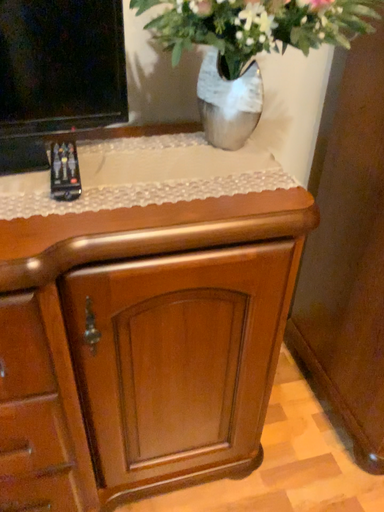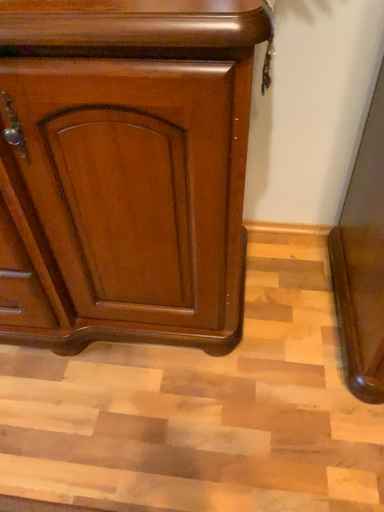
Question: How did the camera likely rotate when shooting the video?

Choices:
 (A) rotated left
 (B) rotated right

Answer: (A)